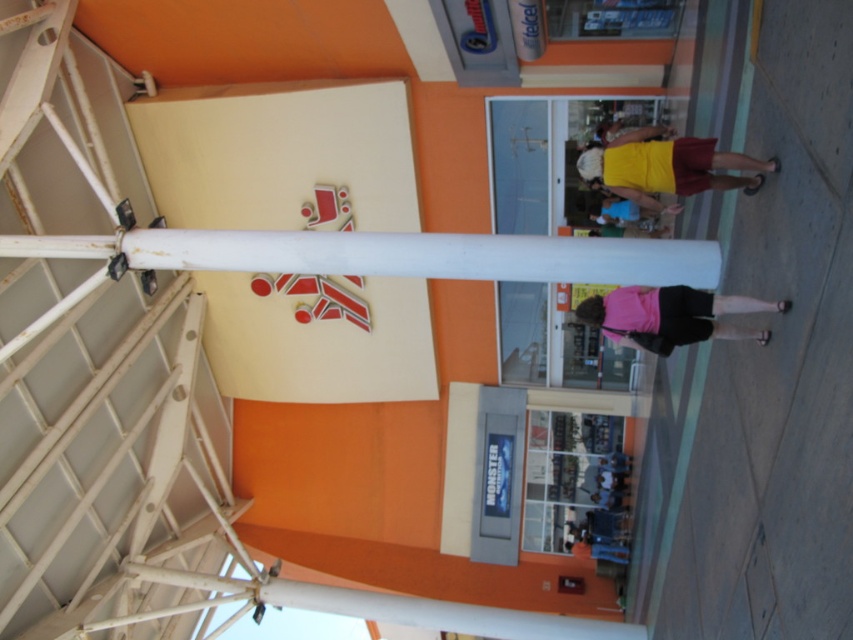
Question: Which point is farther to the camera?

Choices:
 (A) click(x=726, y=308)
 (B) click(x=637, y=168)

Answer: (B)

Question: Can you confirm if yellow matte shirt at upper center is positioned to the left of pink fabric at center?

Choices:
 (A) no
 (B) yes

Answer: (A)

Question: Is yellow matte shirt at upper center below pink fabric at center?

Choices:
 (A) no
 (B) yes

Answer: (A)

Question: Is yellow matte shirt at upper center further to the viewer compared to pink fabric at center?

Choices:
 (A) yes
 (B) no

Answer: (A)